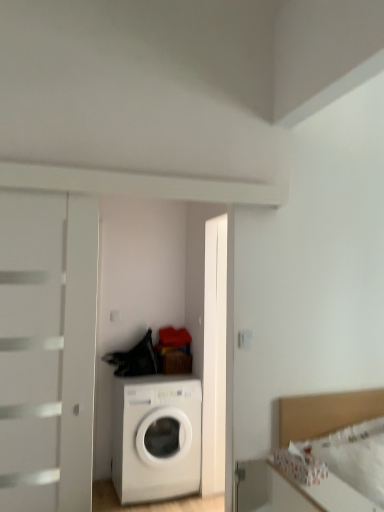
Question: Looking at the image, does white glossy washing machine at center seem bigger or smaller compared to white fabric bed at lower right?

Choices:
 (A) big
 (B) small

Answer: (A)

Question: In the image, is white glossy washing machine at center positioned in front of or behind white fabric bed at lower right?

Choices:
 (A) behind
 (B) front

Answer: (A)

Question: From a real-world perspective, is white glossy washing machine at center above or below white fabric bed at lower right?

Choices:
 (A) below
 (B) above

Answer: (A)

Question: Looking at the image, does white fabric bed at lower right seem bigger or smaller compared to white glossy washing machine at center?

Choices:
 (A) small
 (B) big

Answer: (A)

Question: Is white fabric bed at lower right wider or thinner than white glossy washing machine at center?

Choices:
 (A) wide
 (B) thin

Answer: (B)

Question: From the image's perspective, is white fabric bed at lower right above or below white glossy washing machine at center?

Choices:
 (A) below
 (B) above

Answer: (B)

Question: In the image, is white fabric bed at lower right positioned in front of or behind white glossy washing machine at center?

Choices:
 (A) behind
 (B) front

Answer: (B)